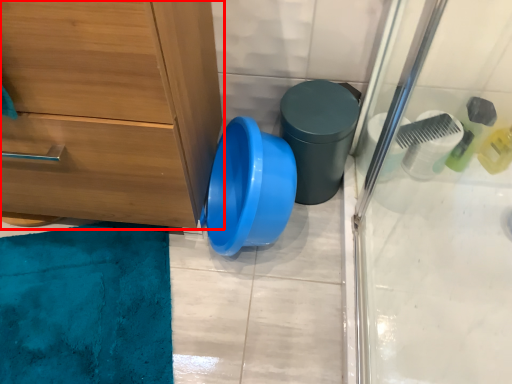
Question: From the image's perspective, where is chest of drawers (annotated by the red box) located relative to potty?

Choices:
 (A) below
 (B) above

Answer: (B)